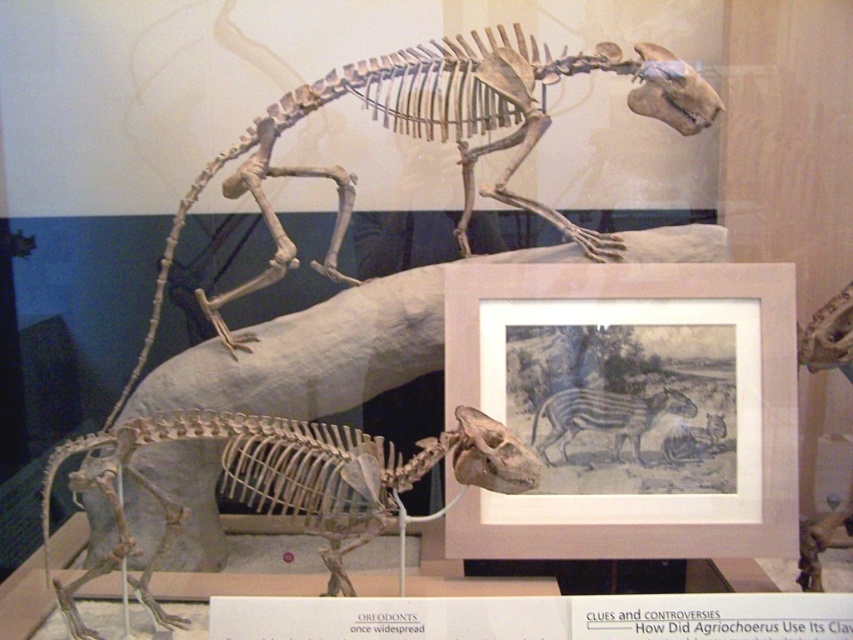
Is grayish-brown textured zebra at center behind gray textured zebra at center?

Yes, grayish-brown textured zebra at center is further from the viewer.

Can you confirm if grayish-brown textured zebra at center is positioned above gray textured zebra at center?

Yes, grayish-brown textured zebra at center is above gray textured zebra at center.

Between point (556, 435) and point (689, 428), which one is positioned in front?

Positioned in front is point (689, 428).

Where is `grayish-brown textured zebra at center`? This screenshot has width=853, height=640. grayish-brown textured zebra at center is located at coordinates click(x=605, y=417).

In the scene shown: Who is more forward, (537,547) or (682,461)?

Point (537,547) is more forward.

Who is positioned more to the right, matte paper picture frame at center or gray textured zebra at center?

gray textured zebra at center is more to the right.

Find the location of a particular element. The image size is (853, 640). matte paper picture frame at center is located at coordinates (630, 406).

Who is lower down, matte paper picture frame at center or grayish-brown textured zebra at center?

Positioned lower is grayish-brown textured zebra at center.

From the picture: Is matte paper picture frame at center thinner than grayish-brown textured zebra at center?

No.

Between point (456, 268) and point (643, 420), which one is positioned in front?

Point (643, 420) is more forward.

Locate an element on the screen. matte paper picture frame at center is located at coordinates (630, 406).